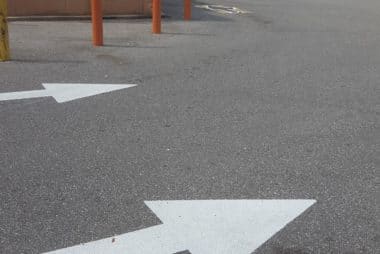
The height and width of the screenshot is (254, 380). I want to click on wall painted brick red, so click(62, 8).